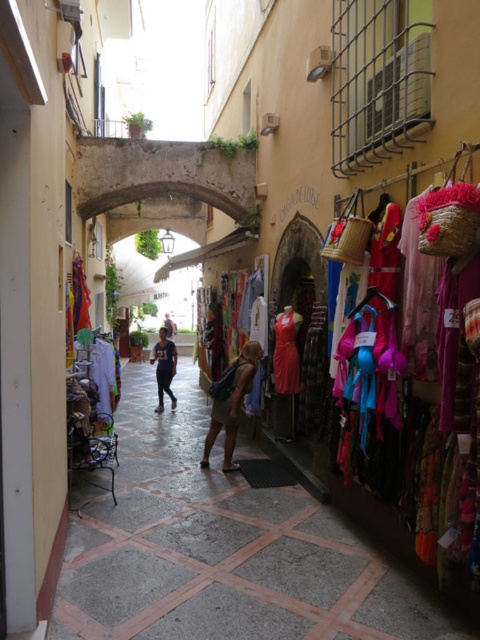
Can you confirm if blue fabric dress at center is thinner than dark blue fabric at center?

In fact, blue fabric dress at center might be wider than dark blue fabric at center.

Who is more forward, (159, 548) or (168, 356)?

Point (159, 548) is in front.

Is point (147, 372) more distant than point (167, 355)?

Yes.

This screenshot has width=480, height=640. In order to click on blue fabric dress at center in this screenshot , I will do `click(222, 547)`.

Does blue fabric dress at center appear on the right side of beige fabric skirt at center?

Incorrect, blue fabric dress at center is not on the right side of beige fabric skirt at center.

In order to click on blue fabric dress at center in this screenshot , I will do `click(222, 547)`.

Is point (231, 451) in front of point (169, 348)?

Yes.

Which of these two, beige fabric skirt at center or dark blue fabric at center, stands shorter?

beige fabric skirt at center

Which is in front, point (235, 422) or point (158, 333)?

Positioned in front is point (235, 422).

The image size is (480, 640). Find the location of `beige fabric skirt at center`. beige fabric skirt at center is located at coordinates (231, 404).